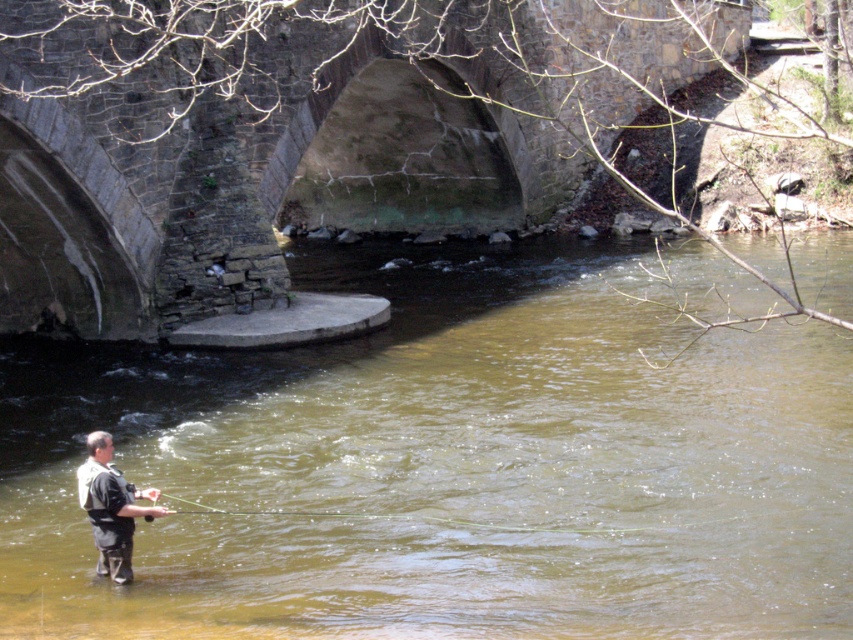
You are standing on the stone bridge and see the brown murky water at center and the dark gray fabric waders at lower left. Which object is closer to you?

The brown murky water at center is closer to you because it is in front of the dark gray fabric waders at lower left.